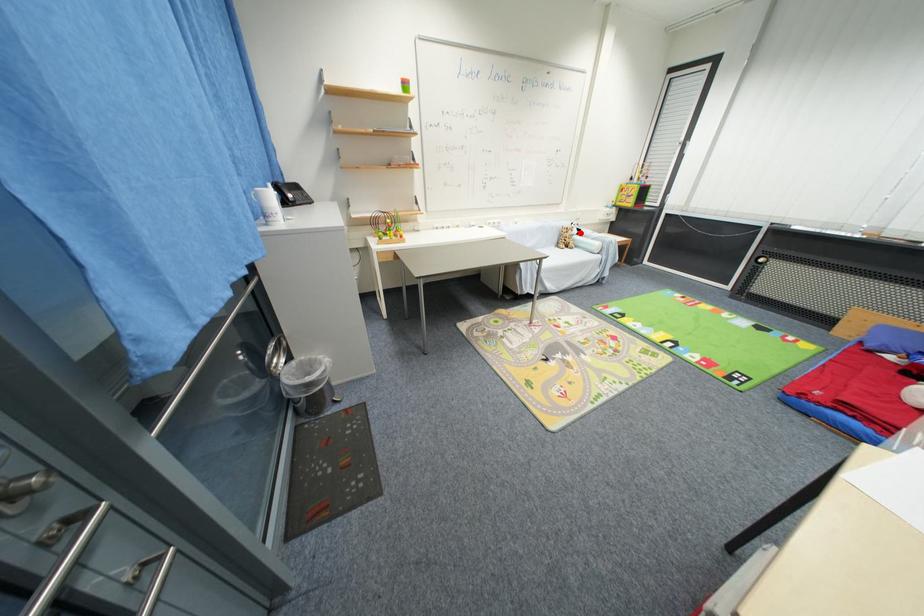
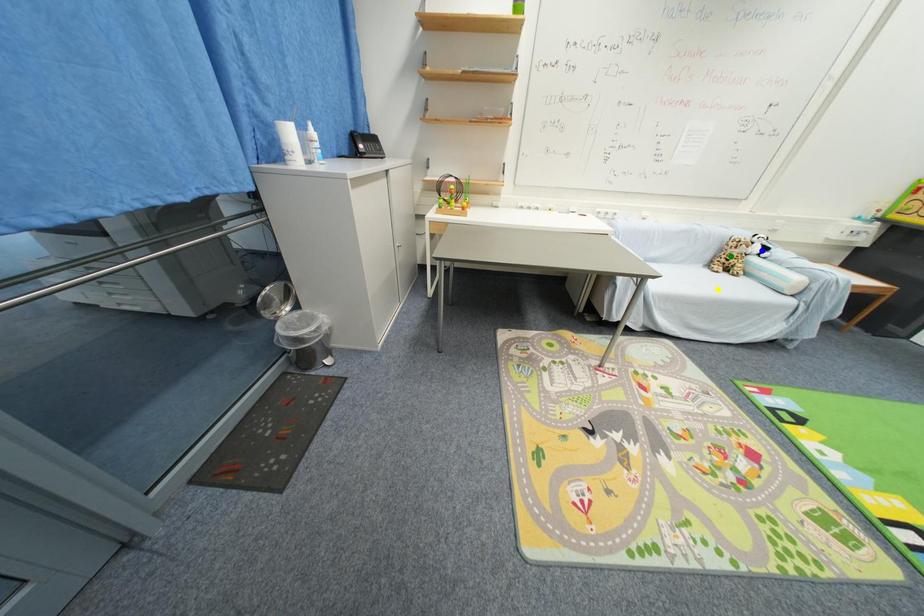
Question: I am providing you with two images of the same scene from different viewpoints. A red point is marked on the first image. You are given multiple points on the second image. Which spot in image 2 lines up with the point in image 1?

Choices:
 (A) green point
 (B) yellow point
 (C) blue point

Answer: (C)